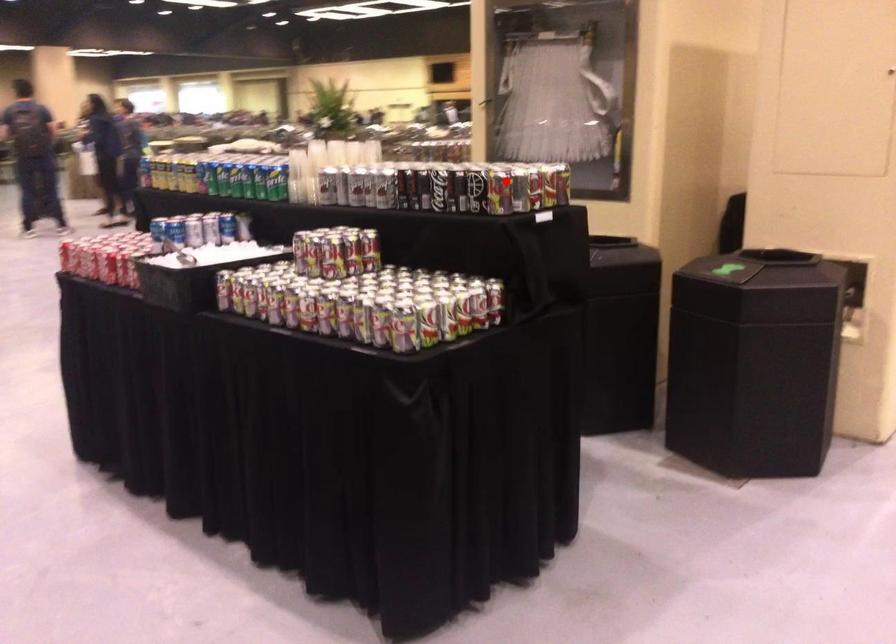
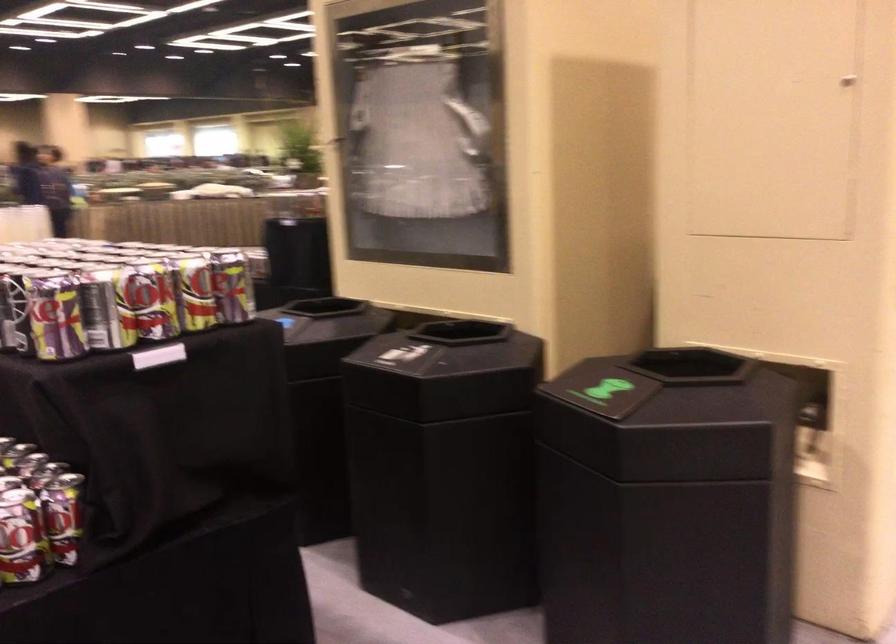
Question: I am providing you with two images of the same scene from different viewpoints. Given a red point in image1, look at the same physical point in image2. Is it:

Choices:
 (A) Closer to the viewpoint
 (B) Farther from the viewpoint

Answer: (A)